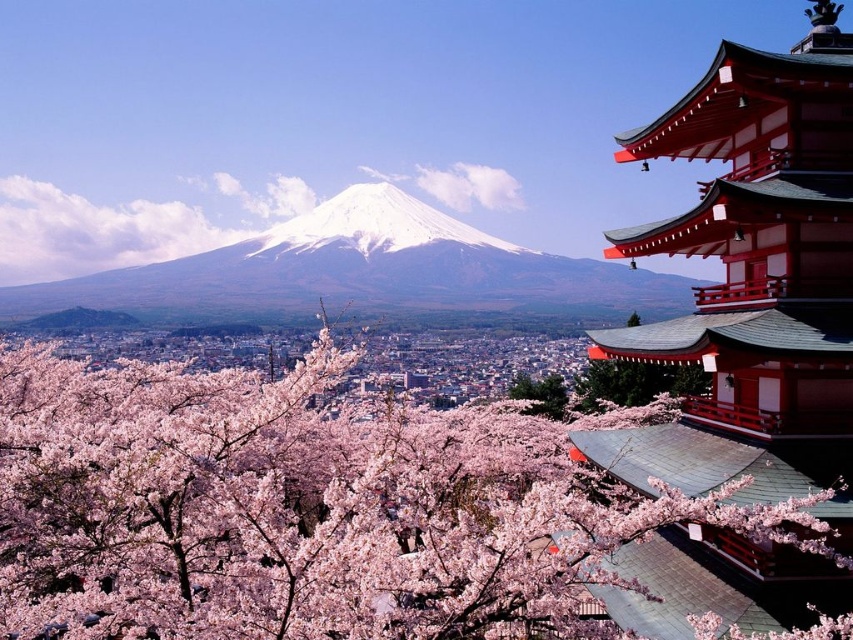
Can you confirm if pink blossoms at center is thinner than white snow-covered mountain at center?

Yes.

Who is more distant from viewer, (x=393, y=483) or (x=393, y=228)?

The point (x=393, y=228) is behind.

Find the location of a particular element. pink blossoms at center is located at coordinates (305, 512).

Is white snow-covered mountain at center thinner than green leafy tree at center?

No.

Which is more to the left, white snow-covered mountain at center or green leafy tree at center?

white snow-covered mountain at center

Between point (341, 204) and point (546, 416), which one is positioned in front?

Point (546, 416)

You are a GUI agent. You are given a task and a screenshot of the screen. Output one action in this format:
    pyautogui.click(x=<x>, y=<y>)
    Task: Click on the white snow-covered mountain at center
    
    Given the screenshot: What is the action you would take?
    pyautogui.click(x=374, y=225)

Does white snow-covered mountain at upper left appear on the left side of green leafy tree at center?

Correct, you'll find white snow-covered mountain at upper left to the left of green leafy tree at center.

Can you confirm if white snow-covered mountain at upper left is smaller than green leafy tree at center?

Incorrect, white snow-covered mountain at upper left is not smaller in size than green leafy tree at center.

Is point (364, 198) more distant than point (548, 380)?

Yes, it is.

Image resolution: width=853 pixels, height=640 pixels. I want to click on white snow-covered mountain at upper left, so click(x=363, y=269).